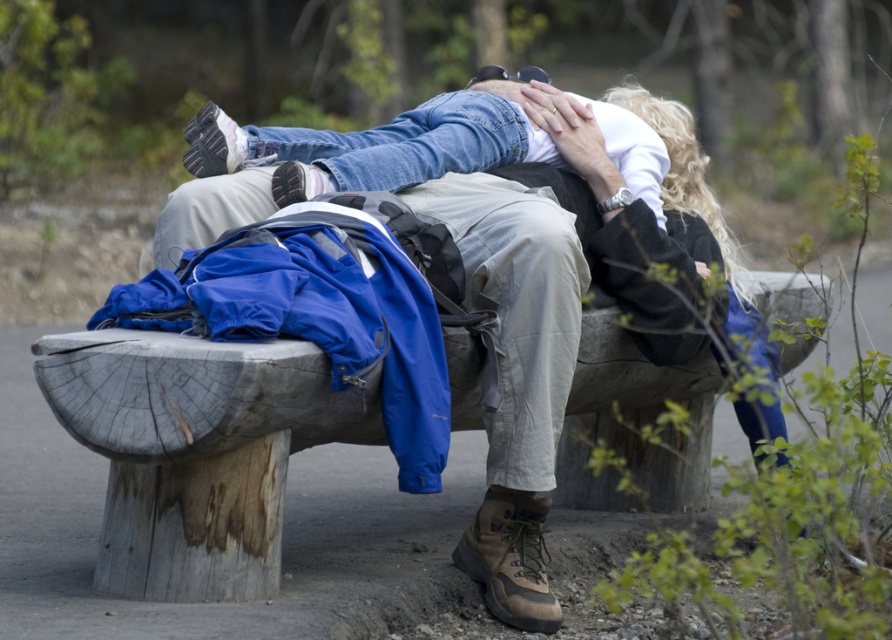
Which is in front, point (552, 340) or point (205, 548)?

Positioned in front is point (205, 548).

Can you confirm if matte blue jacket at center is wider than weathered wood bench at center?

Yes.

In order to click on matte blue jacket at center in this screenshot , I will do `click(502, 221)`.